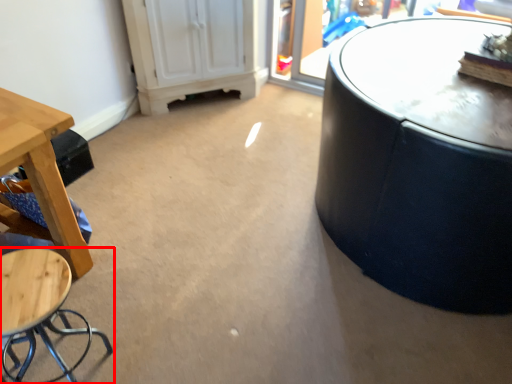
Question: From the image's perspective, what is the correct spatial positioning of stool (annotated by the red box) in reference to table?

Choices:
 (A) below
 (B) above

Answer: (A)